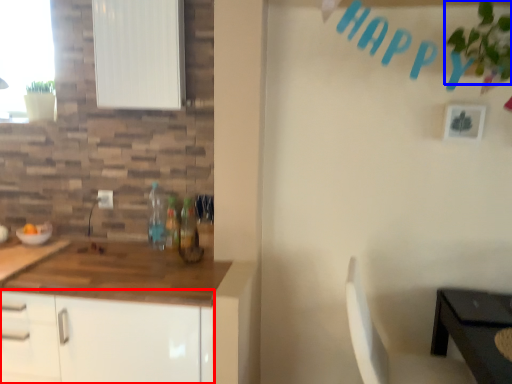
Question: Among these objects, which one is nearest to the camera, cabinetry (highlighted by a red box) or plant (highlighted by a blue box)?

Choices:
 (A) cabinetry
 (B) plant

Answer: (B)